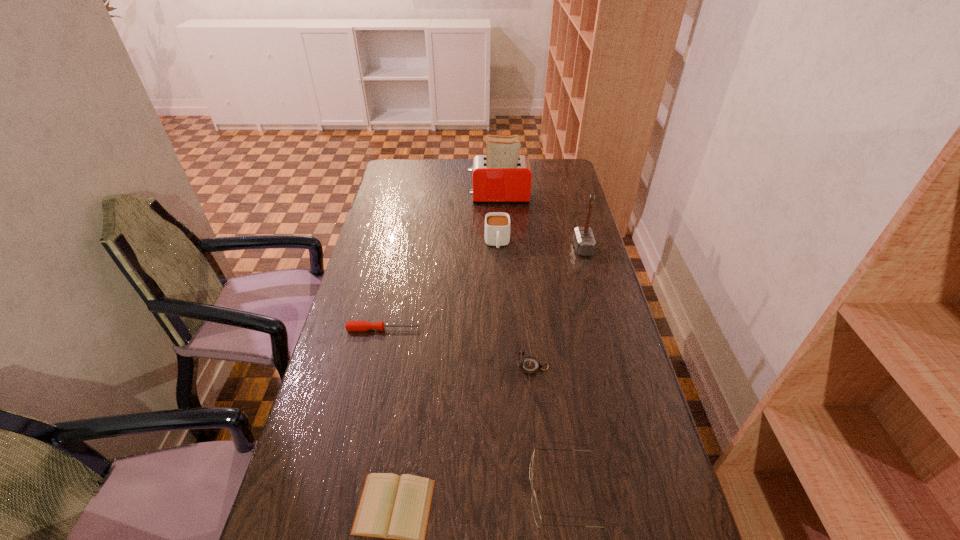
Locate an element on the screen. empty location between the screwdriver and the rightmost object is located at coordinates (483, 288).

At what (x,y) coordinates should I click in order to perform the action: click on empty location between the sixth shortest object and the fifth farthest object. Please return your answer as a coordinate pair (x, y). The width and height of the screenshot is (960, 540). Looking at the image, I should click on (558, 307).

I want to click on free space between the farthest object and the hammer, so 540,222.

The height and width of the screenshot is (540, 960). I want to click on free space between the farthest object and the fifth farthest object, so click(516, 281).

At what (x,y) coordinates should I click in order to perform the action: click on free spot between the fifth tallest object and the farthest object. Please return your answer as a coordinate pair (x, y). This screenshot has width=960, height=540. Looking at the image, I should click on (532, 344).

Locate an element on the screen. The image size is (960, 540). object that stands as the second closest to the rightmost object is located at coordinates (502, 175).

You are a GUI agent. You are given a task and a screenshot of the screen. Output one action in this format:
    pyautogui.click(x=<x>, y=<y>)
    Task: Click on the object that is the third closest to the farthest object
    The image size is (960, 540).
    Given the screenshot: What is the action you would take?
    pyautogui.click(x=350, y=325)